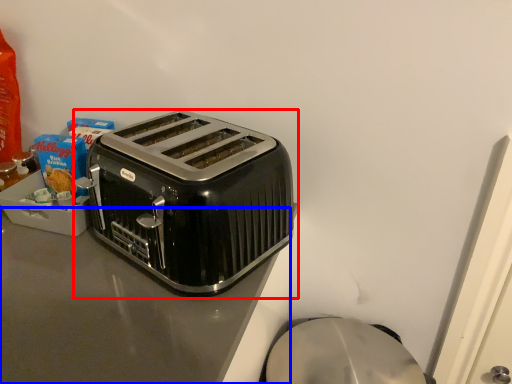
Question: Which point is closer to the camera, toaster (highlighted by a red box) or counter top (highlighted by a blue box)?

Choices:
 (A) toaster
 (B) counter top

Answer: (B)